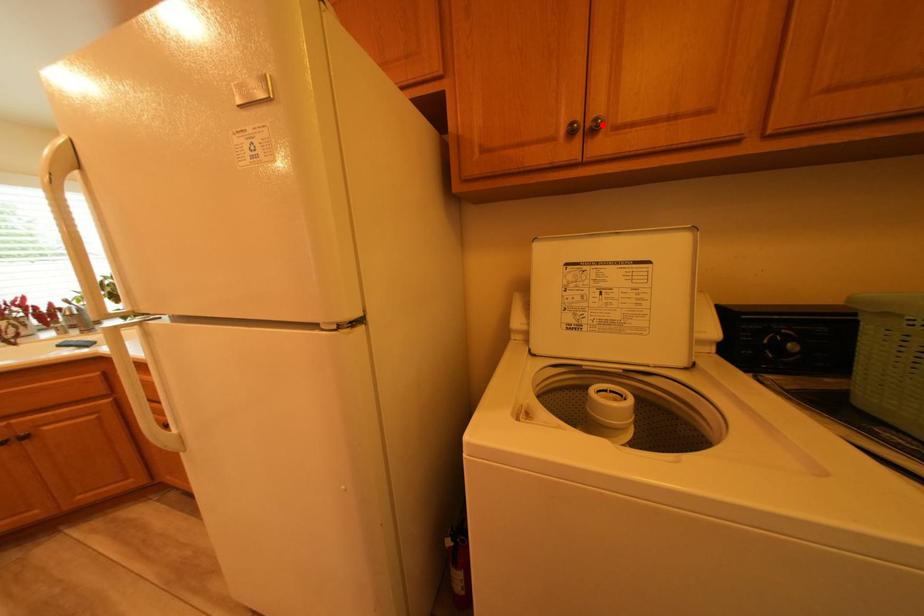
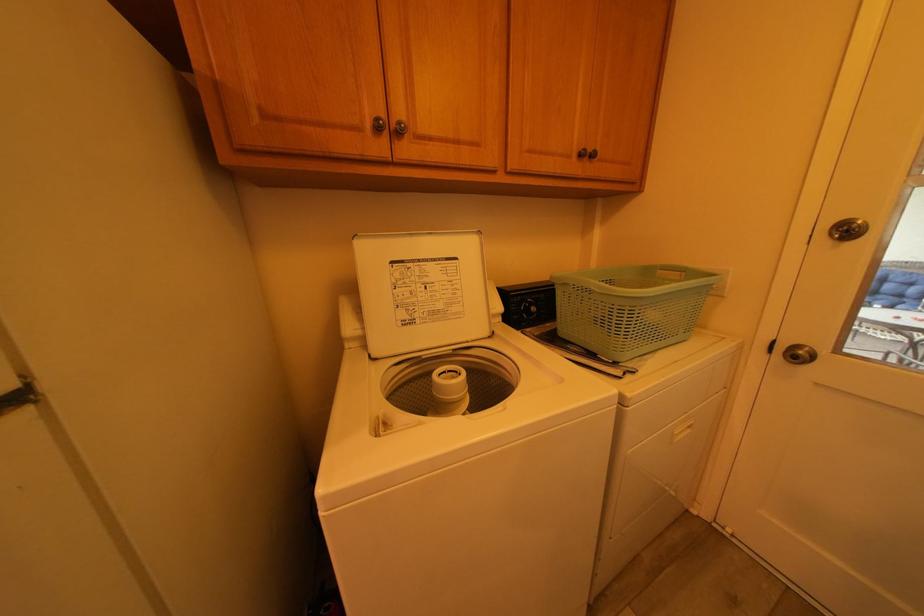
Locate, in the second image, the point that corresponds to the highlighted location in the first image.

(407, 126)